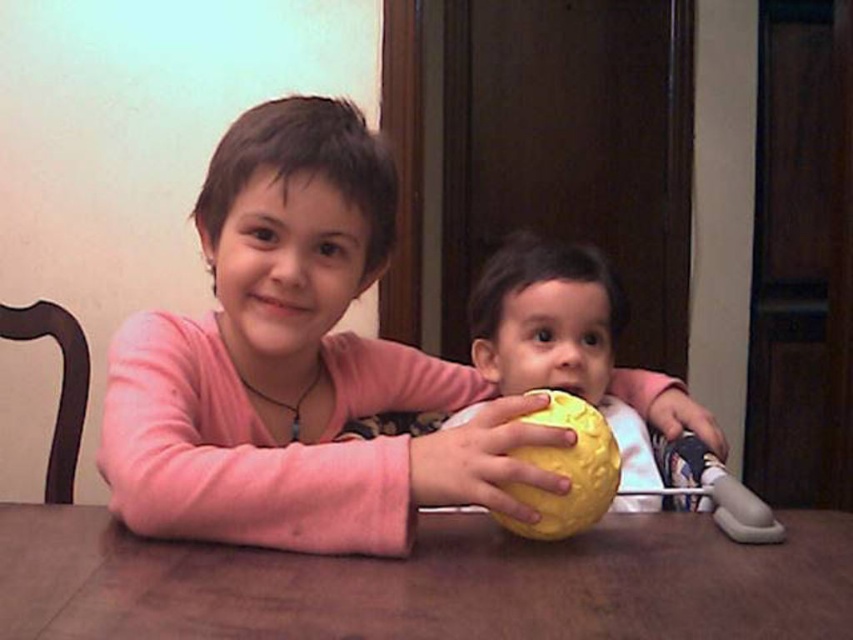
Which is behind, point (285, 538) or point (26, 612)?

Positioned behind is point (285, 538).

Does matte yellow ball at center appear on the left side of smooth wooden table at center?

No, matte yellow ball at center is not to the left of smooth wooden table at center.

Describe the element at coordinates (296, 364) in the screenshot. The image size is (853, 640). I see `matte yellow ball at center` at that location.

Image resolution: width=853 pixels, height=640 pixels. In order to click on matte yellow ball at center in this screenshot , I will do `click(296, 364)`.

Is point (258, 502) positioned behind point (612, 400)?

No, it is not.

In order to click on matte yellow ball at center in this screenshot , I will do `click(296, 364)`.

From the picture: Is smooth wooden table at center closer to camera compared to yellow rubber ball at center?

Yes, it is.

Between point (811, 540) and point (496, 336), which one is positioned in front?

Point (811, 540)

Is point (654, 605) positioned after point (596, 365)?

That is False.

The width and height of the screenshot is (853, 640). I want to click on smooth wooden table at center, so click(427, 582).